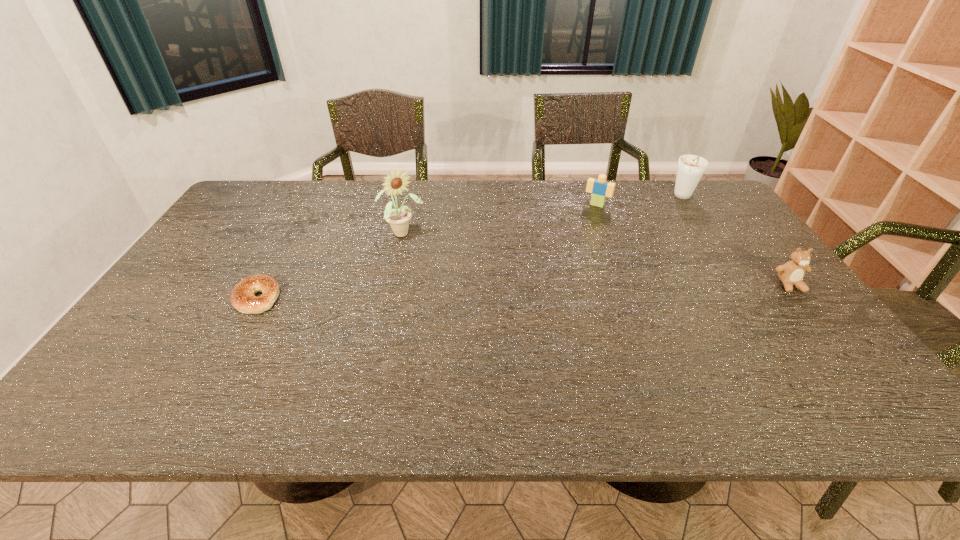
Locate an element on the screen. The image size is (960, 540). empty location between the bagel and the rightmost object is located at coordinates (523, 292).

Select which object appears as the closest to the leftmost object. Please provide its 2D coordinates. Your answer should be formatted as a tuple, i.e. [(x, y)], where the tuple contains the x and y coordinates of a point satisfying the conditions above.

[(398, 219)]

Select which object appears as the closest to the second object from right to left. Please provide its 2D coordinates. Your answer should be formatted as a tuple, i.e. [(x, y)], where the tuple contains the x and y coordinates of a point satisfying the conditions above.

[(600, 188)]

Image resolution: width=960 pixels, height=540 pixels. In order to click on vacant point that satisfies the following two spatial constraints: 1. on the back side of the leftmost object; 2. on the left side of the sunflower in this screenshot , I will do `click(292, 234)`.

Locate an element on the screen. The image size is (960, 540). vacant space that satisfies the following two spatial constraints: 1. on the back side of the shortest object; 2. on the right side of the root beer is located at coordinates (312, 197).